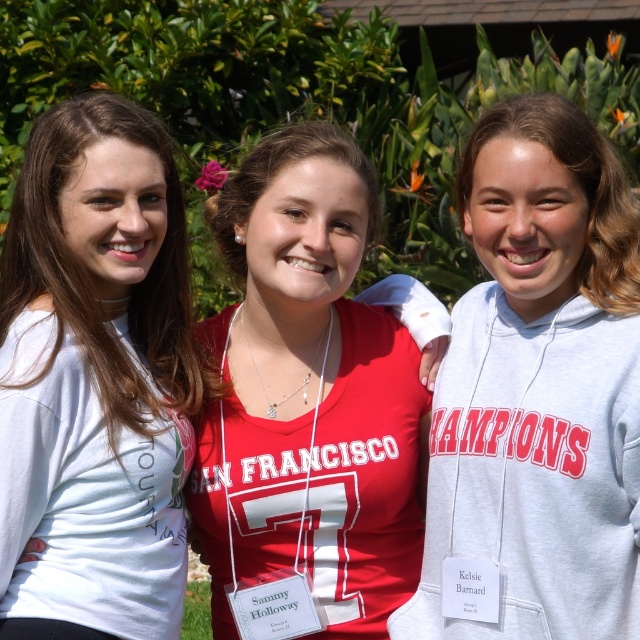
Which is more to the left, white matte shirt at center or gray fleece sweatshirt at center?

white matte shirt at center is more to the left.

In the scene shown: Between white matte shirt at center and gray fleece sweatshirt at center, which one is positioned lower?

Positioned lower is white matte shirt at center.

This screenshot has height=640, width=640. I want to click on white matte shirt at center, so click(96, 380).

At what (x,y) coordinates should I click in order to perform the action: click on white matte shirt at center. Please return your answer as a coordinate pair (x, y). The height and width of the screenshot is (640, 640). Looking at the image, I should click on (96, 380).